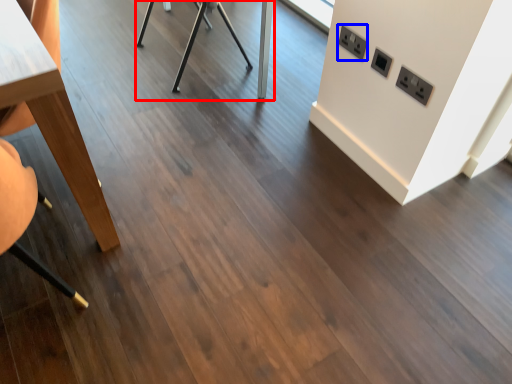
Question: Which of the following is the closest to the observer, table (highlighted by a red box) or electric outlet (highlighted by a blue box)?

Choices:
 (A) table
 (B) electric outlet

Answer: (B)